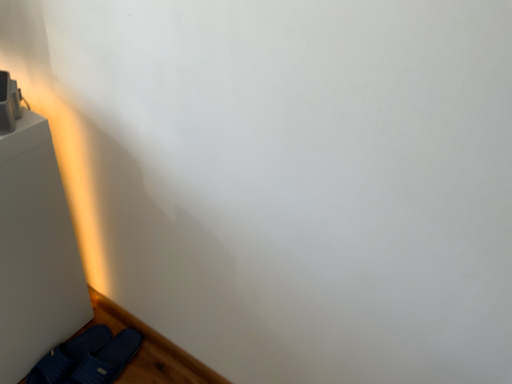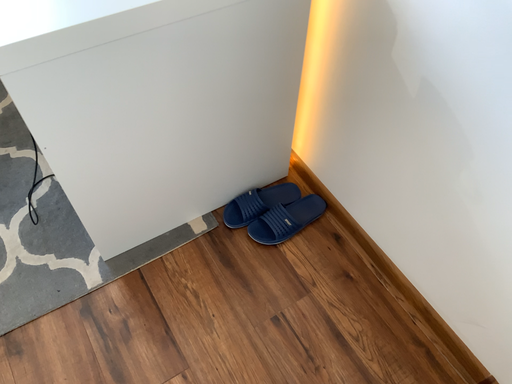
Question: How did the camera likely rotate when shooting the video?

Choices:
 (A) rotated downward
 (B) rotated upward

Answer: (A)